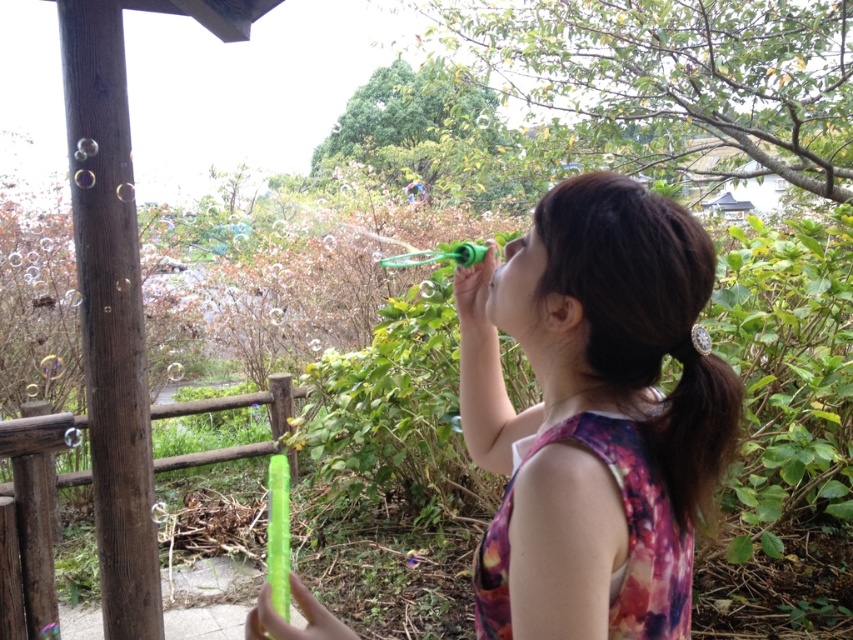
Between brown wood pole at left and green plastic rail at center, which one is positioned lower?

Positioned lower is green plastic rail at center.

Does point (151, 611) come farther from viewer compared to point (7, 422)?

Yes.

Where is `brown wood pole at left`? The width and height of the screenshot is (853, 640). brown wood pole at left is located at coordinates (109, 314).

Locate an element on the screen. Image resolution: width=853 pixels, height=640 pixels. matte green bubble wand at center is located at coordinates (595, 413).

Between point (706, 360) and point (144, 561), which one is positioned behind?

Point (144, 561)

Locate an element on the screen. The height and width of the screenshot is (640, 853). matte green bubble wand at center is located at coordinates (595, 413).

Locate an element on the screen. The width and height of the screenshot is (853, 640). matte green bubble wand at center is located at coordinates (595, 413).

Is green plastic rail at center further to camera compared to brown silky hair at upper right?

That is True.

Which is more to the left, green plastic rail at center or brown silky hair at upper right?

Positioned to the left is green plastic rail at center.

Identify the location of green plastic rail at center. The width and height of the screenshot is (853, 640). (28, 520).